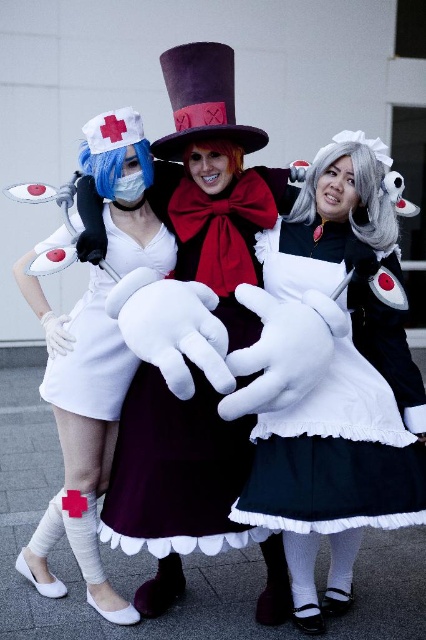
Question: Which is farther from the white matte nurse outfit at left?

Choices:
 (A) white matte dress at center
 (B) black satin dress at center

Answer: (B)

Question: Which point is farther from the camera taking this photo?

Choices:
 (A) (75, 356)
 (B) (356, 372)

Answer: (A)

Question: Which of the following is the farthest from the observer?

Choices:
 (A) (143, 260)
 (B) (224, 492)
 (C) (270, 433)

Answer: (A)

Question: From the image, what is the correct spatial relationship of white matte nurse outfit at left in relation to white matte dress at center?

Choices:
 (A) left
 (B) right

Answer: (A)

Question: In this image, where is black satin dress at center located relative to maroon satin dress at center?

Choices:
 (A) below
 (B) above

Answer: (A)

Question: In this image, where is black satin dress at center located relative to maroon satin dress at center?

Choices:
 (A) left
 (B) right

Answer: (B)